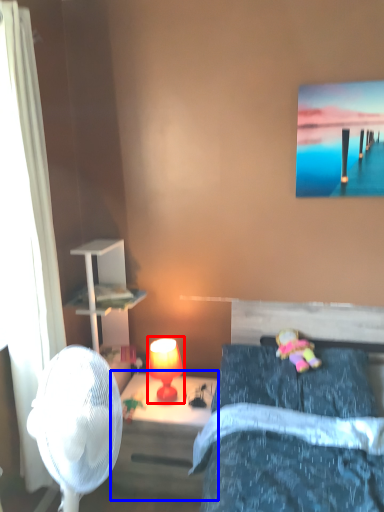
Question: Which object is closer to the camera taking this photo, table lamp (highlighted by a red box) or nightstand (highlighted by a blue box)?

Choices:
 (A) table lamp
 (B) nightstand

Answer: (B)